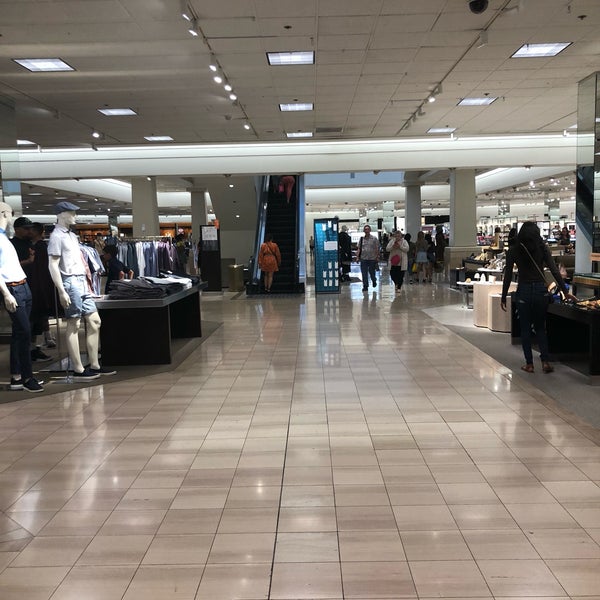
Locate an element on the screen. Image resolution: width=600 pixels, height=600 pixels. shelves is located at coordinates (589, 295), (483, 289), (149, 315).